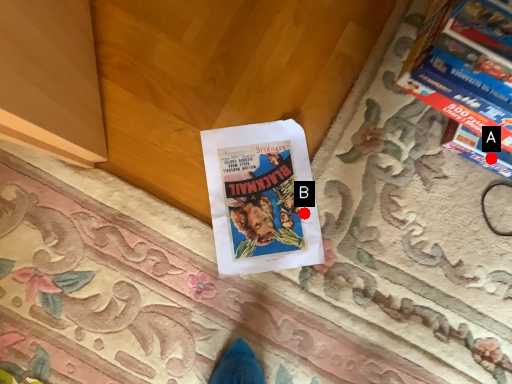
Question: Two points are circled on the image, labeled by A and B beside each circle. Which point is further to the camera?

Choices:
 (A) A is further
 (B) B is further

Answer: (B)